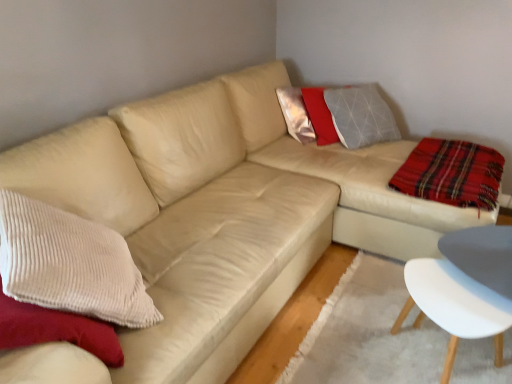
Question: In the image, is white plastic chair at lower right positioned in front of or behind plaid fabric at right?

Choices:
 (A) behind
 (B) front

Answer: (B)

Question: Looking at the image, does white plastic chair at lower right seem bigger or smaller compared to plaid fabric at right?

Choices:
 (A) big
 (B) small

Answer: (A)

Question: In terms of width, does white plastic chair at lower right look wider or thinner when compared to plaid fabric at right?

Choices:
 (A) thin
 (B) wide

Answer: (A)

Question: Based on their sizes in the image, would you say plaid fabric at right is bigger or smaller than white plastic chair at lower right?

Choices:
 (A) small
 (B) big

Answer: (A)

Question: In terms of height, does plaid fabric at right look taller or shorter compared to white plastic chair at lower right?

Choices:
 (A) short
 (B) tall

Answer: (A)

Question: In the image, is plaid fabric at right on the left side or the right side of white plastic chair at lower right?

Choices:
 (A) left
 (B) right

Answer: (B)

Question: Considering the positions of point (458, 155) and point (454, 319), is point (458, 155) closer or farther from the camera than point (454, 319)?

Choices:
 (A) farther
 (B) closer

Answer: (A)